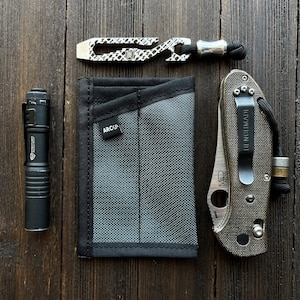
The width and height of the screenshot is (300, 300). I want to click on wooden plank, so click(30, 277), click(108, 279), click(181, 276), click(243, 280), click(297, 268).